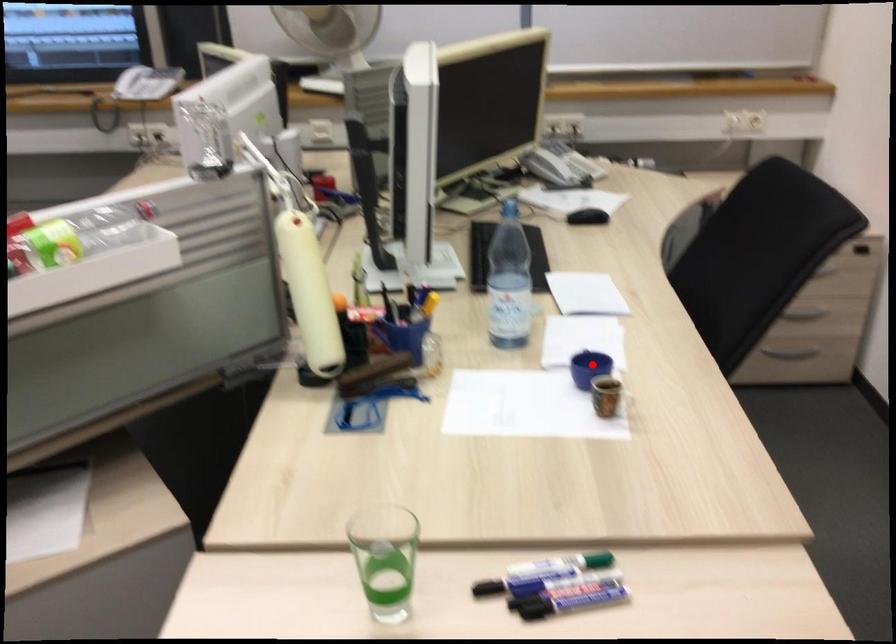
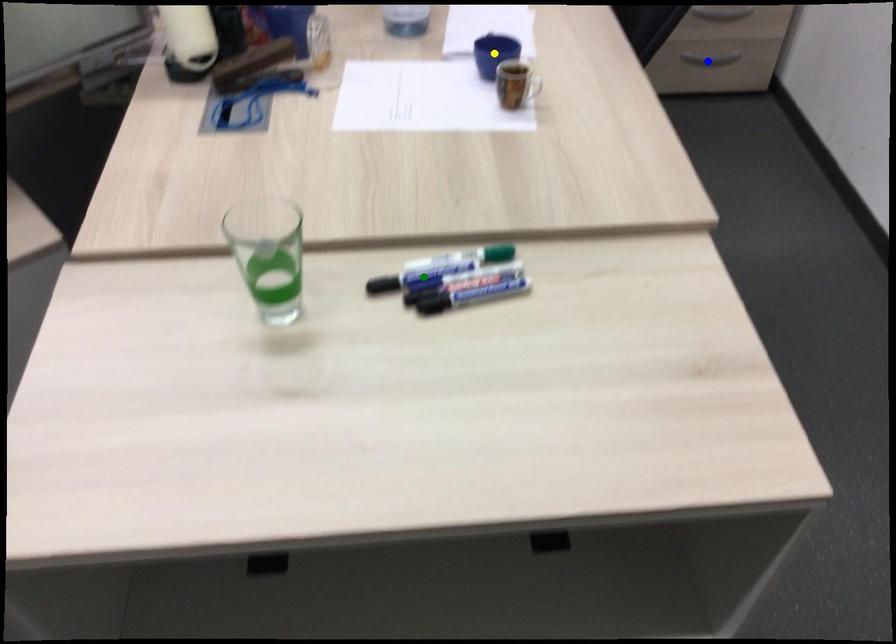
Question: I am providing you with two images of the same scene from different viewpoints. A red point is marked on the first image. You are given multiple points on the second image. Which point in image 2 is actually the same real-world point as the red point in image 1?

Choices:
 (A) yellow point
 (B) blue point
 (C) green point

Answer: (A)